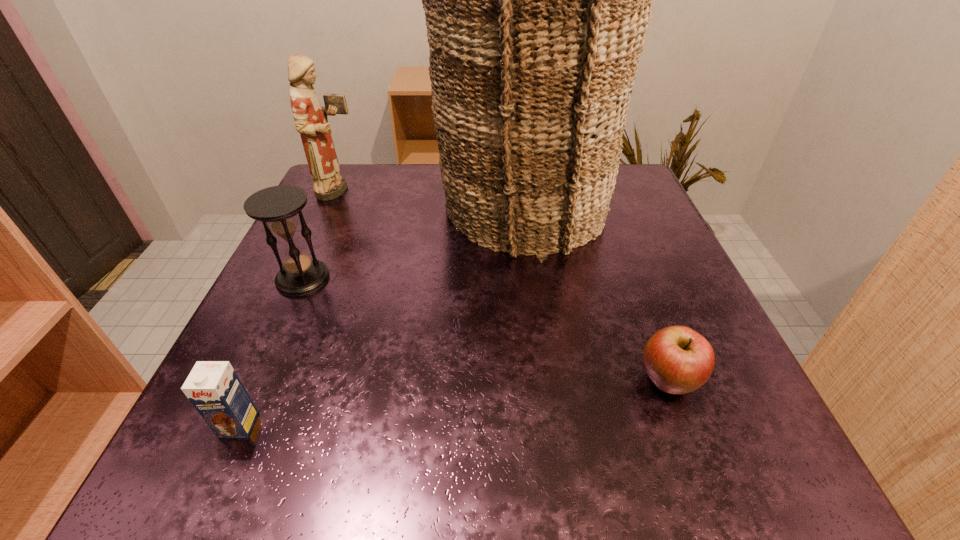
Where is `basket situated at the far edge`? The width and height of the screenshot is (960, 540). basket situated at the far edge is located at coordinates (537, 0).

Where is `figurine at the far edge`? Image resolution: width=960 pixels, height=540 pixels. figurine at the far edge is located at coordinates (x=311, y=121).

This screenshot has width=960, height=540. Find the location of `object that is at the near edge`. object that is at the near edge is located at coordinates (213, 387).

What are the coordinates of `figurine located in the left edge section of the desktop` in the screenshot? It's located at (x=311, y=121).

This screenshot has width=960, height=540. In order to click on hourglass that is at the left edge in this screenshot , I will do `click(277, 207)`.

What are the coordinates of `chocolate milk at the left edge` in the screenshot? It's located at (213, 387).

Where is `basket present at the right edge`? The image size is (960, 540). basket present at the right edge is located at coordinates (537, 0).

Image resolution: width=960 pixels, height=540 pixels. Identify the location of apple that is positioned at the right edge. (678, 360).

Locate an element on the screen. Image resolution: width=960 pixels, height=540 pixels. object at the far left corner is located at coordinates (311, 121).

This screenshot has width=960, height=540. What are the coordinates of `object that is at the near left corner` in the screenshot? It's located at (213, 387).